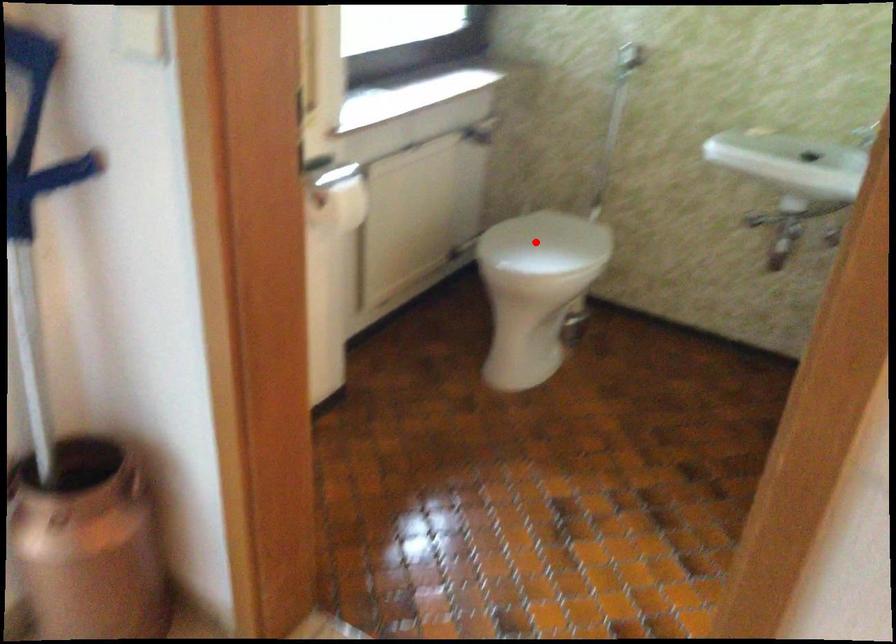
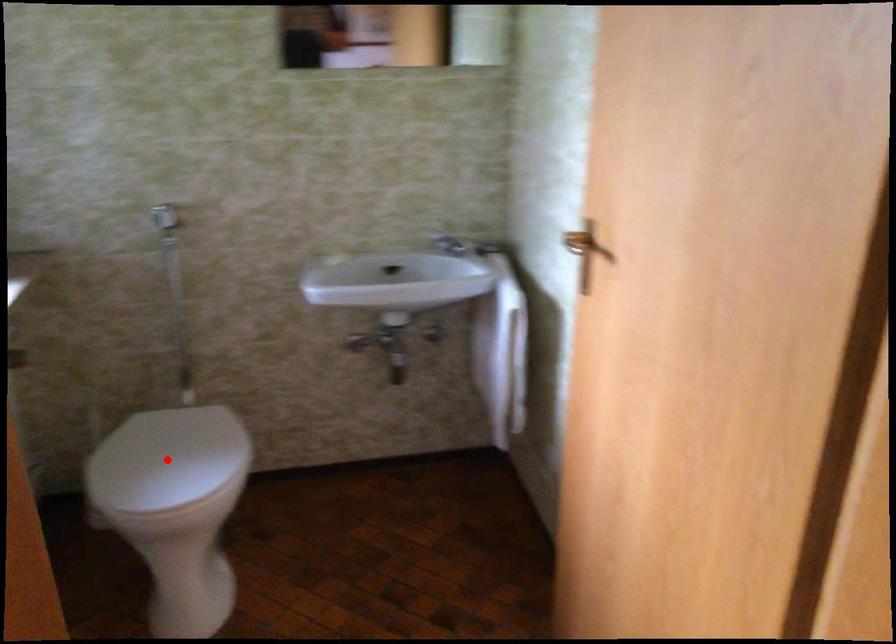
I am providing you with two images of the same scene from different viewpoints. A red point is marked on the first image and another point is marked on the second image. Do the highlighted points in image1 and image2 indicate the same real-world spot?

Yes